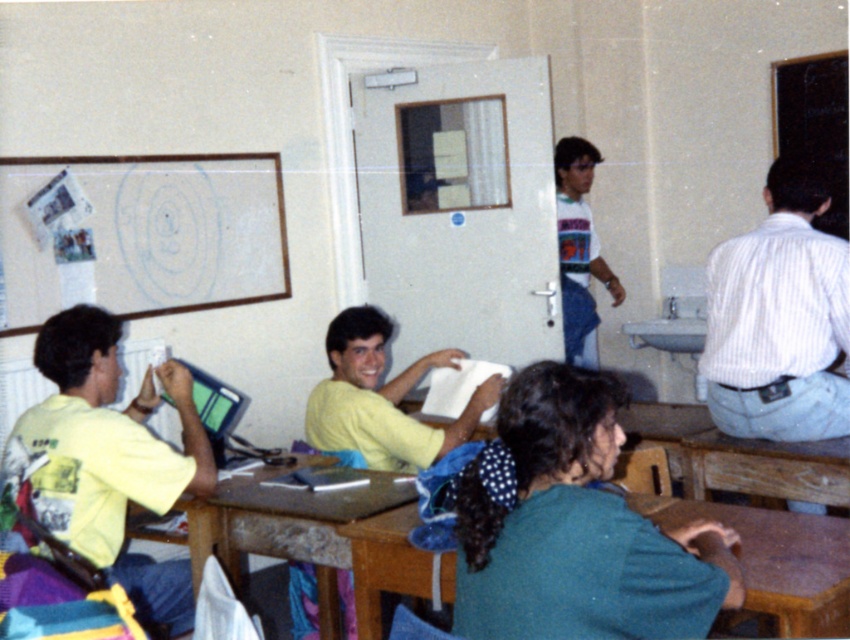
Is yellow matte shirt at left above white printed t-shirt at center?

Incorrect, yellow matte shirt at left is not positioned above white printed t-shirt at center.

Is point (68, 445) positioned in front of point (561, 161)?

Yes, it is in front of point (561, 161).

Does point (106, 381) come closer to viewer compared to point (557, 230)?

Yes, it is in front of point (557, 230).

Where is `yellow matte shirt at left`? Image resolution: width=850 pixels, height=640 pixels. yellow matte shirt at left is located at coordinates (112, 458).

Does point (24, 211) come closer to viewer compared to point (565, 275)?

Yes, it is.

You are a GUI agent. You are given a task and a screenshot of the screen. Output one action in this format:
    pyautogui.click(x=<x>, y=<y>)
    Task: Click on the white paperboard at upper left
    
    Given the screenshot: What is the action you would take?
    pyautogui.click(x=149, y=234)

Is white paperboard at upper left to the right of brown wooden table at lower center from the viewer's perspective?

In fact, white paperboard at upper left is to the left of brown wooden table at lower center.

Who is shorter, white paperboard at upper left or brown wooden table at lower center?

With less height is brown wooden table at lower center.

This screenshot has height=640, width=850. I want to click on white paperboard at upper left, so click(x=149, y=234).